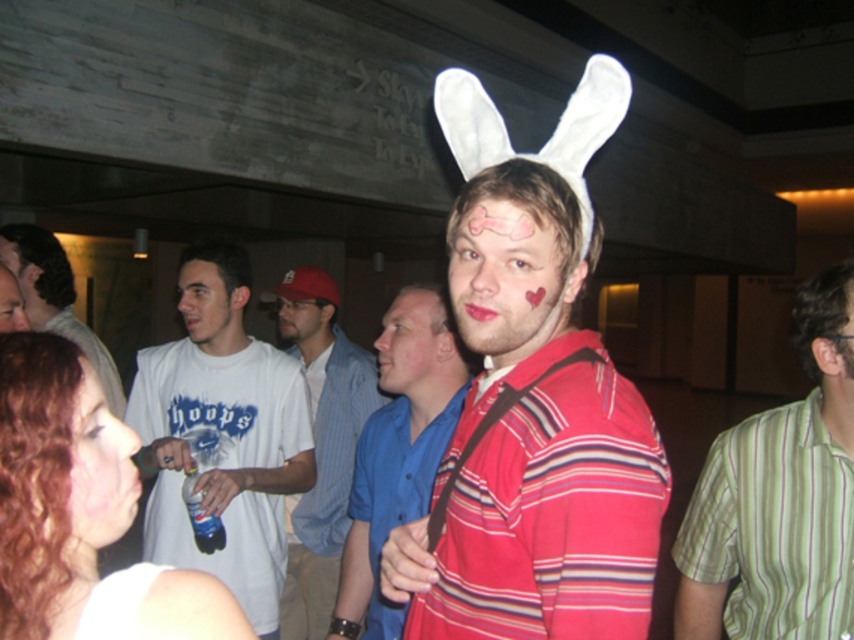
Does white shirt at center have a greater width compared to smooth skin face at center?

Correct, the width of white shirt at center exceeds that of smooth skin face at center.

Who is taller, white shirt at center or smooth skin face at center?

white shirt at center

Locate an element on the screen. The height and width of the screenshot is (640, 854). white shirt at center is located at coordinates (56, 298).

Is matte red shirt at center taller than matte pink heart at center?

Yes.

Is matte red shirt at center in front of matte pink heart at center?

Yes.

Does point (621, 422) come farther from viewer compared to point (500, 214)?

That is False.

Find the location of a particular element. The width and height of the screenshot is (854, 640). matte red shirt at center is located at coordinates (553, 518).

Which of these two, white cotton shirt at center or matte white cap at center, stands taller?

white cotton shirt at center

Is point (313, 508) behind point (281, 332)?

No.

At what (x,y) coordinates should I click in order to perform the action: click on white cotton shirt at center. Please return your answer as a coordinate pair (x, y). The width and height of the screenshot is (854, 640). Looking at the image, I should click on (323, 460).